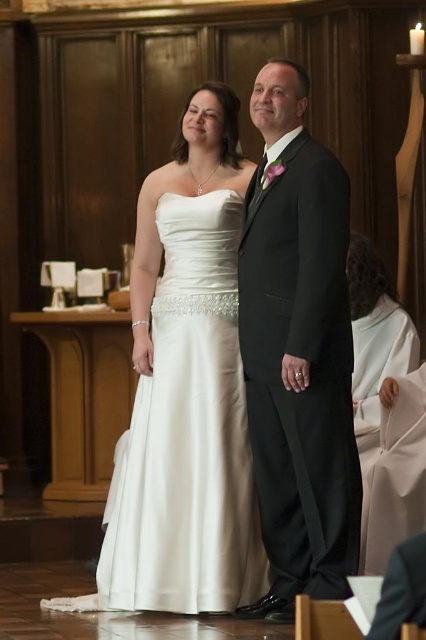
Can you confirm if white satin dress at center is thinner than black satin suit at center?

No, white satin dress at center is not thinner than black satin suit at center.

Is white satin dress at center taller than black satin suit at center?

No.

Between point (141, 513) and point (328, 292), which one is positioned in front?

Point (328, 292) is in front.

Find the location of `white satin dress at center`. white satin dress at center is located at coordinates (187, 387).